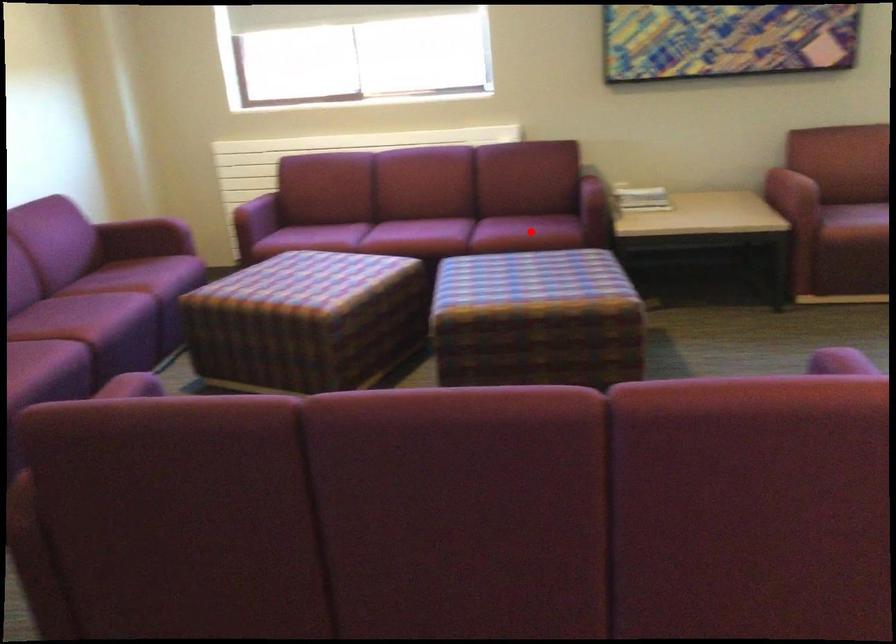
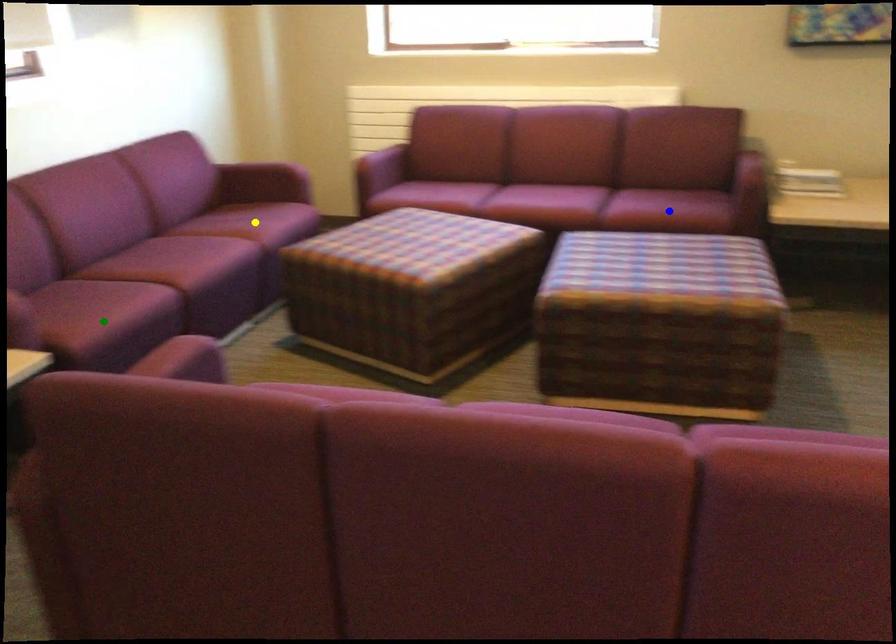
Question: I am providing you with two images of the same scene from different viewpoints. A red point is marked on the first image. You are given multiple points on the second image. Which point in image 2 is actually the same real-world point as the red point in image 1?

Choices:
 (A) blue point
 (B) yellow point
 (C) green point

Answer: (A)